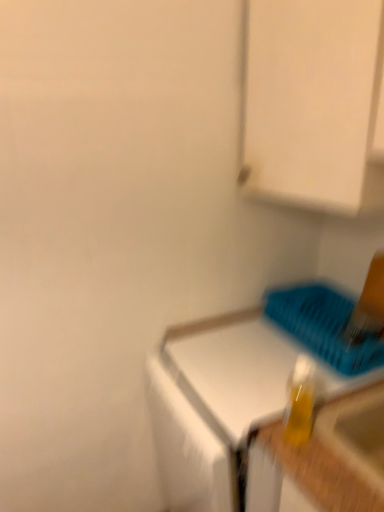
Question: Is blue plastic basket at lower right positioned behind white glossy countertop at center?

Choices:
 (A) no
 (B) yes

Answer: (B)

Question: Is blue plastic basket at lower right outside white glossy countertop at center?

Choices:
 (A) no
 (B) yes

Answer: (B)

Question: From the image's perspective, would you say blue plastic basket at lower right is shown under white glossy countertop at center?

Choices:
 (A) yes
 (B) no

Answer: (B)

Question: Considering the relative sizes of blue plastic basket at lower right and white glossy countertop at center in the image provided, is blue plastic basket at lower right shorter than white glossy countertop at center?

Choices:
 (A) yes
 (B) no

Answer: (A)

Question: From the image's perspective, would you say blue plastic basket at lower right is positioned over white glossy countertop at center?

Choices:
 (A) no
 (B) yes

Answer: (B)

Question: Does blue plastic basket at lower right appear on the right side of white glossy countertop at center?

Choices:
 (A) yes
 (B) no

Answer: (A)

Question: From the image's perspective, would you say translucent yellow bottle at lower right is shown under white matte cabinet at upper right?

Choices:
 (A) no
 (B) yes

Answer: (B)

Question: Does translucent yellow bottle at lower right touch white matte cabinet at upper right?

Choices:
 (A) yes
 (B) no

Answer: (B)

Question: Can you confirm if translucent yellow bottle at lower right is wider than white matte cabinet at upper right?

Choices:
 (A) no
 (B) yes

Answer: (A)

Question: Is translucent yellow bottle at lower right not close to white matte cabinet at upper right?

Choices:
 (A) no
 (B) yes

Answer: (A)

Question: Is translucent yellow bottle at lower right outside of white matte cabinet at upper right?

Choices:
 (A) yes
 (B) no

Answer: (A)

Question: From a real-world perspective, is translucent yellow bottle at lower right physically below white matte cabinet at upper right?

Choices:
 (A) yes
 (B) no

Answer: (A)

Question: Is translucent yellow bottle at lower right facing away from white glossy countertop at center?

Choices:
 (A) yes
 (B) no

Answer: (B)